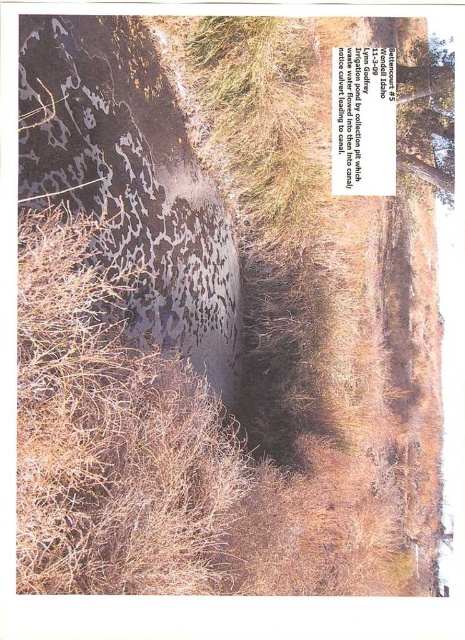
Question: Where is dark textured rock at left located in relation to green leafy tree at upper right in the image?

Choices:
 (A) right
 (B) left

Answer: (B)

Question: Can you confirm if dark textured rock at left is positioned below green leafy tree at upper right?

Choices:
 (A) yes
 (B) no

Answer: (A)

Question: Is dark textured rock at left bigger than green leafy tree at upper right?

Choices:
 (A) yes
 (B) no

Answer: (A)